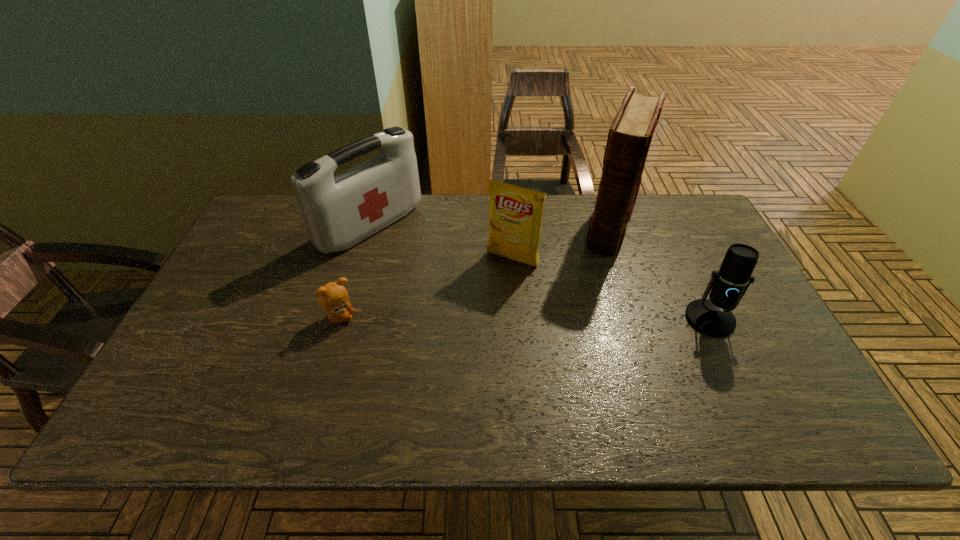
This screenshot has width=960, height=540. Identify the location of the shortest object. 333,297.

I want to click on microphone, so click(x=713, y=317).

Identify the location of the fourth object from left to right. This screenshot has height=540, width=960. (630, 134).

Locate an element on the screen. the tallest object is located at coordinates pyautogui.click(x=630, y=134).

Find the location of `the third object from left to right`. the third object from left to right is located at coordinates (x=515, y=217).

Locate an element on the screen. The image size is (960, 540). the first-aid kit is located at coordinates (338, 212).

Identify the location of vacant space located 0.110m on the face of the teddy bear. (397, 318).

Where is `vacant space located on the left of the rightmost object`? vacant space located on the left of the rightmost object is located at coordinates (612, 319).

The image size is (960, 540). What are the coordinates of `vacant region located on the spine side of the second object from right to left` in the screenshot? It's located at [x=582, y=326].

The height and width of the screenshot is (540, 960). In order to click on free space located 0.290m on the spine side of the second object from right to left in this screenshot , I will do `click(583, 322)`.